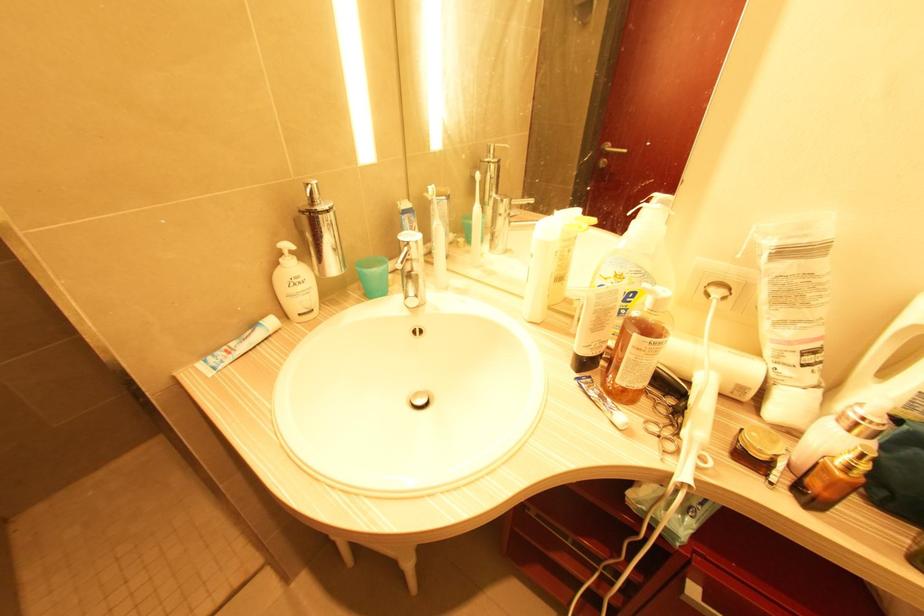
At what (x,y) coordinates should I click in order to perform the action: click on green plastic cup. Please return your answer as a coordinate pair (x, y). This screenshot has width=924, height=616. Looking at the image, I should click on (372, 275).